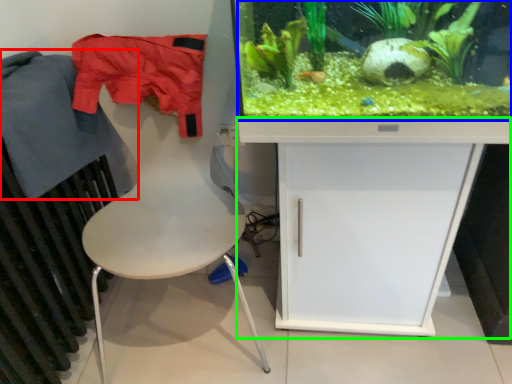
Question: Which object is the closest to the clothing (highlighted by a red box)? Choose among these: plant (highlighted by a blue box) or computer desk (highlighted by a green box).

Choices:
 (A) plant
 (B) computer desk

Answer: (A)